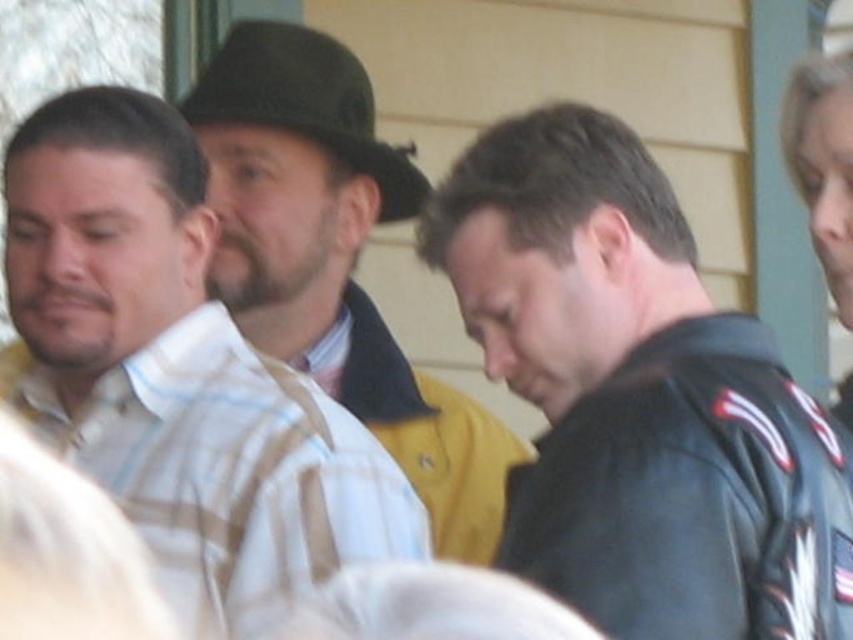
Question: Is black leather jacket at center wider than black felt fedora at center?

Choices:
 (A) yes
 (B) no

Answer: (A)

Question: Which object is the closest to the black leather jacket at center?

Choices:
 (A) black felt fedora at center
 (B) striped cotton shirt at left
 (C) matte brown hat at center

Answer: (C)

Question: Which object appears closest to the camera in this image?

Choices:
 (A) black leather jacket at center
 (B) striped cotton shirt at left
 (C) matte brown hat at center
 (D) black felt fedora at center

Answer: (A)

Question: In this image, where is black leather jacket at center located relative to matte brown hat at center?

Choices:
 (A) left
 (B) right

Answer: (B)

Question: Estimate the real-world distances between objects in this image. Which object is farther from the black leather jacket at center?

Choices:
 (A) striped cotton shirt at left
 (B) matte brown hat at center

Answer: (A)

Question: Does black leather jacket at center appear on the left side of striped cotton shirt at left?

Choices:
 (A) no
 (B) yes

Answer: (A)